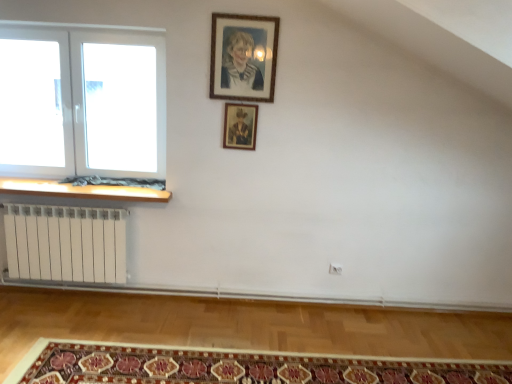
Question: From a real-world perspective, relative to carpeted mat at lower center, is wooden picture frame at upper center, the 1th picture frame positioned from the back, vertically above or below?

Choices:
 (A) above
 (B) below

Answer: (A)

Question: Which is correct: wooden picture frame at upper center, which appears as the second picture frame when viewed from the front, is inside carpeted mat at lower center, or outside of it?

Choices:
 (A) outside
 (B) inside

Answer: (A)

Question: Which object is positioned closest to the carpeted mat at lower center?

Choices:
 (A) wooden picture frame at upper center, positioned as the 2th picture frame in top-to-bottom order
 (B) wooden picture frame at upper center, the 2th picture frame when ordered from back to front
 (C) wooden at left
 (D) white plastic window at left

Answer: (C)

Question: Estimate the real-world distances between objects in this image. Which object is farther from the wooden picture frame at upper center, positioned as the 2th picture frame in top-to-bottom order?

Choices:
 (A) wooden at left
 (B) carpeted mat at lower center
 (C) wooden picture frame at upper center, the 2th picture frame when ordered from back to front
 (D) white plastic window at left

Answer: (B)